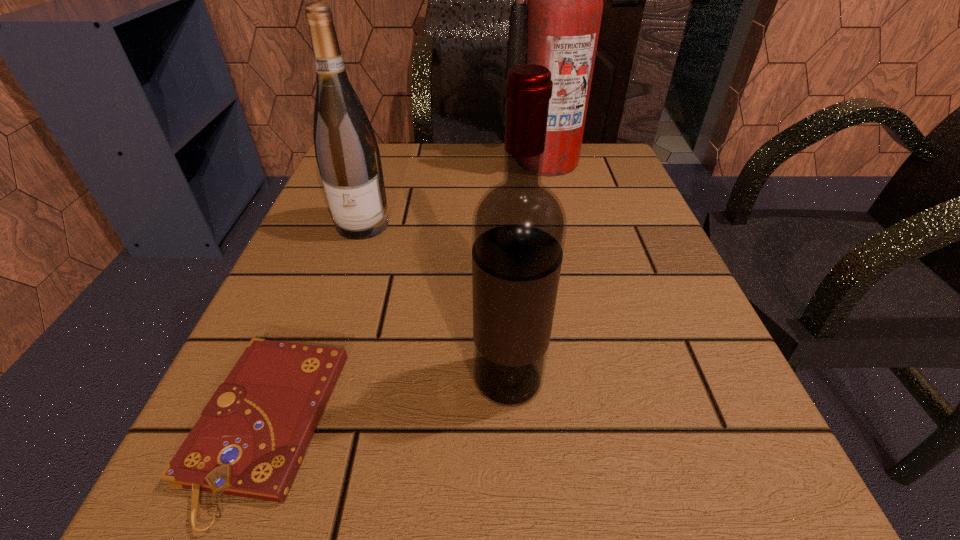
You are a GUI agent. You are given a task and a screenshot of the screen. Output one action in this format:
    pyautogui.click(x=<x>, y=<y>)
    Task: Click on the blank area at the far right corner
    This screenshot has height=540, width=960.
    Given the screenshot: What is the action you would take?
    click(612, 149)

Locate an element on the screen. vacant area at the near right corner is located at coordinates (662, 477).

Locate an element on the screen. The image size is (960, 540). free point between the right wine bottle and the third nearest object is located at coordinates (436, 302).

Locate an element on the screen. This screenshot has height=540, width=960. free space between the farther wine bottle and the shortest object is located at coordinates (314, 326).

Identify the location of vacant area between the fire extinguisher and the notebook. This screenshot has height=540, width=960. (406, 295).

This screenshot has height=540, width=960. In order to click on empty space that is in between the farther wine bottle and the nearer wine bottle in this screenshot , I will do `click(436, 302)`.

At what (x,y) coordinates should I click in order to perform the action: click on free area in between the shortest object and the tallest object. Please return your answer as a coordinate pair (x, y). The width and height of the screenshot is (960, 540). Looking at the image, I should click on (406, 295).

Find the location of a particular element. unoccupied position between the farthest object and the notebook is located at coordinates (406, 295).

Find the location of `vacant area that lies between the right wine bottle and the left wine bottle`. vacant area that lies between the right wine bottle and the left wine bottle is located at coordinates (436, 302).

Find the location of a particular element. Image resolution: width=960 pixels, height=540 pixels. unoccupied position between the tallest object and the shortest object is located at coordinates (406, 295).